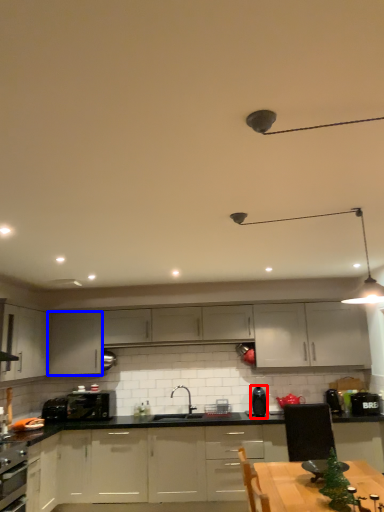
Question: Which point is further to the camera, kitchen appliance (highlighted by a red box) or cabinetry (highlighted by a blue box)?

Choices:
 (A) kitchen appliance
 (B) cabinetry

Answer: (B)